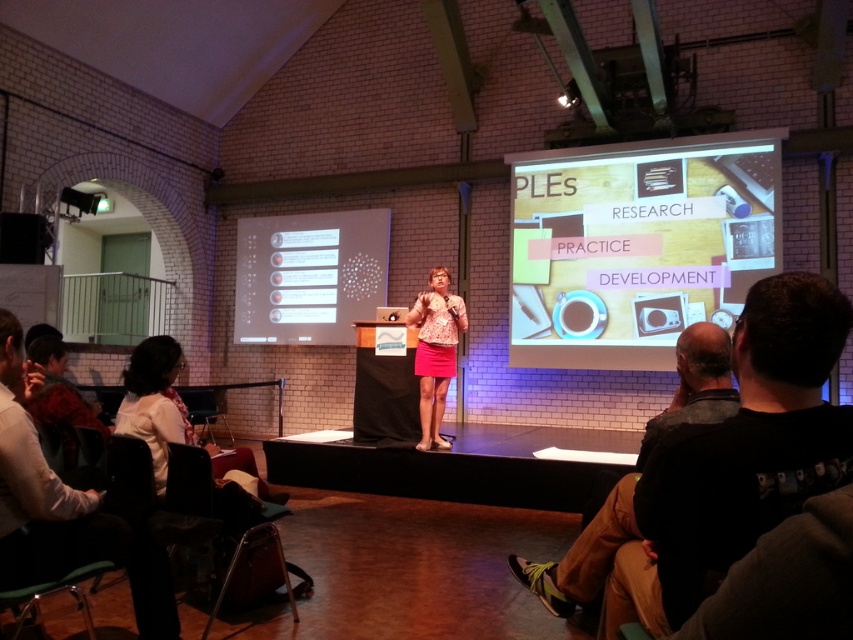
Based on the photo, you are an attendee sitting in the front row of the presentation. You notice two points marked on the stage. Which point is closer to you, point at coordinates [299,332] or point at coordinates [440,416]?

Point at coordinates [299,332] is closer to you than point at coordinates [440,416] because it is further to the viewer according to the description.

You are an attendee sitting in the front row of the presentation. You notice the speaker is standing at the podium. Which object is closer to your left side, the matte white screen at center or the pink fabric skirt at center?

The matte white screen at center is positioned on the left side of the pink fabric skirt at center, so from your perspective in the front row, the matte white screen at center would be closer to your left side.